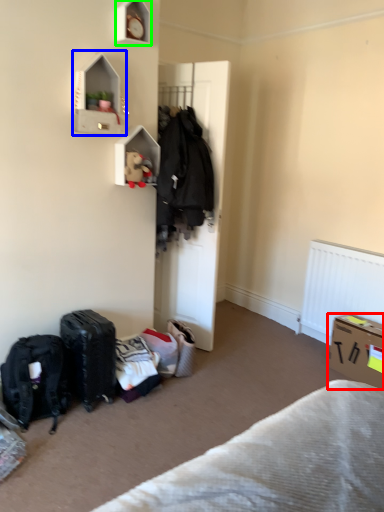
Question: Estimate the real-world distances between objects in this image. Which object is closer to box (highlighted by a red box), cabinet (highlighted by a blue box) or shelf (highlighted by a green box)?

Choices:
 (A) cabinet
 (B) shelf

Answer: (A)